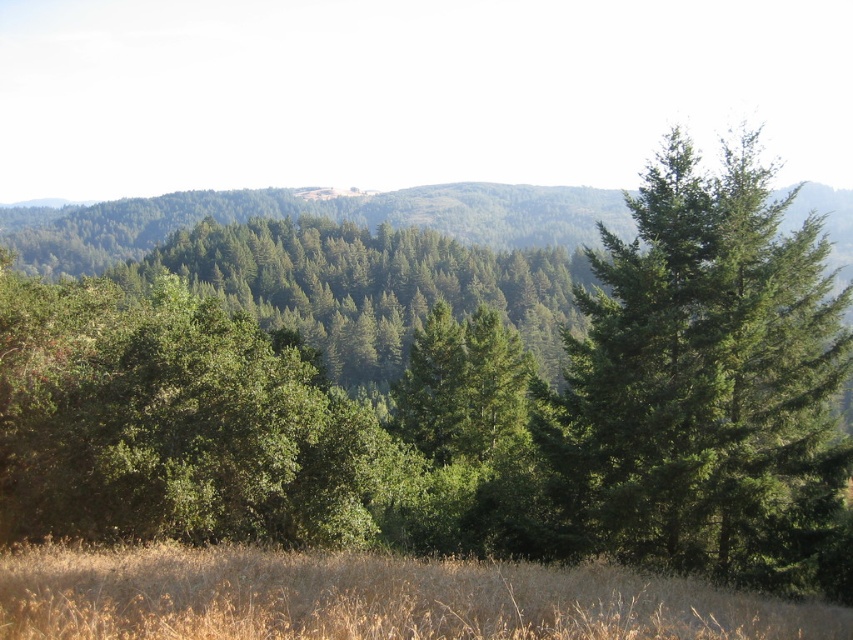
Which is behind, point (695, 333) or point (485, 600)?

Positioned behind is point (695, 333).

The height and width of the screenshot is (640, 853). What are the coordinates of `green matte tree at center` in the screenshot? It's located at (467, 410).

The height and width of the screenshot is (640, 853). Identify the location of green matte tree at center. (467, 410).

Is point (524, 355) in front of point (720, 513)?

No, (524, 355) is behind (720, 513).

Does green matte tree at center appear under green needle-like tree at right?

Correct, green matte tree at center is located below green needle-like tree at right.

This screenshot has width=853, height=640. Identify the location of green matte tree at center. (467, 410).

Who is positioned more to the right, green needle-like tree at right or dry grass at lower center?

From the viewer's perspective, green needle-like tree at right appears more on the right side.

Who is shorter, green needle-like tree at right or dry grass at lower center?

With less height is dry grass at lower center.

Which is behind, point (723, 394) or point (477, 564)?

The point (723, 394) is more distant.

This screenshot has height=640, width=853. Find the location of `green needle-like tree at right`. green needle-like tree at right is located at coordinates (706, 385).